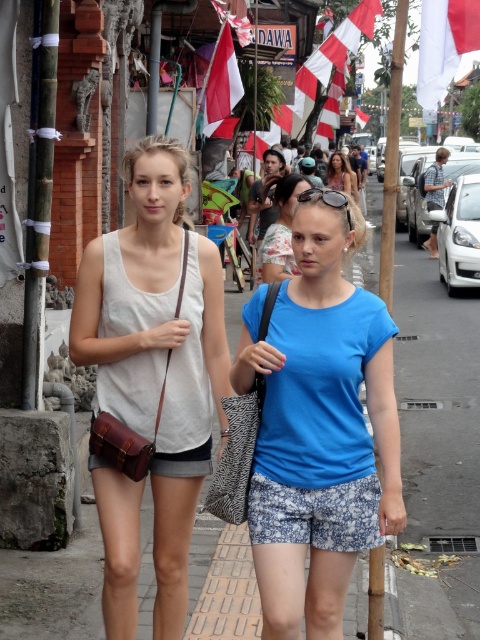
You are standing at the origin point in the image. Where is the matte blue shirt at center located in terms of coordinates?

The matte blue shirt at center is located at coordinates 0.272 in the x direction and 0.706 in the y direction.

You are a window cleaner standing on a ladder at the base of the building where the white fabric flag at upper center and red fabric flag at upper center are hanging. You need to clean both flags but can only reach up to 3 meters. Can you reach both flags?

The white fabric flag at upper center and red fabric flag at upper center are 3.61 meters apart from each other, so the distance between them is greater than your reach. You may need assistance to clean both flags.